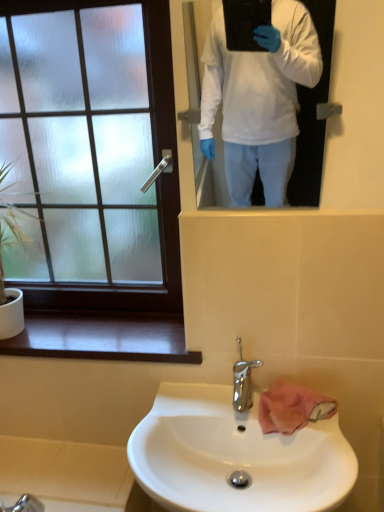
Question: Considering the relative positions of white glossy mirror at upper center and white glossy sink at lower center in the image provided, is white glossy mirror at upper center to the right of white glossy sink at lower center from the viewer's perspective?

Choices:
 (A) no
 (B) yes

Answer: (B)

Question: Is the depth of white glossy mirror at upper center less than that of white glossy sink at lower center?

Choices:
 (A) yes
 (B) no

Answer: (B)

Question: From a real-world perspective, is white glossy mirror at upper center on white glossy sink at lower center?

Choices:
 (A) yes
 (B) no

Answer: (A)

Question: Is white glossy mirror at upper center positioned far away from white glossy sink at lower center?

Choices:
 (A) no
 (B) yes

Answer: (B)

Question: Considering the relative sizes of white glossy mirror at upper center and white glossy sink at lower center in the image provided, is white glossy mirror at upper center thinner than white glossy sink at lower center?

Choices:
 (A) yes
 (B) no

Answer: (A)

Question: Can you confirm if white glossy mirror at upper center is bigger than white glossy sink at lower center?

Choices:
 (A) no
 (B) yes

Answer: (A)

Question: Is white glossy mirror at upper center closer to the viewer compared to frosted glass window at upper left?

Choices:
 (A) no
 (B) yes

Answer: (B)

Question: Can you confirm if white glossy mirror at upper center is wider than frosted glass window at upper left?

Choices:
 (A) no
 (B) yes

Answer: (A)

Question: Is white glossy mirror at upper center not close to frosted glass window at upper left?

Choices:
 (A) no
 (B) yes

Answer: (A)

Question: Is white glossy mirror at upper center taller than frosted glass window at upper left?

Choices:
 (A) yes
 (B) no

Answer: (B)

Question: Is white glossy mirror at upper center looking in the opposite direction of frosted glass window at upper left?

Choices:
 (A) yes
 (B) no

Answer: (B)

Question: Is white glossy mirror at upper center not inside frosted glass window at upper left?

Choices:
 (A) yes
 (B) no

Answer: (A)

Question: Does green leafy plant at left have a larger size compared to white glossy sink at lower center?

Choices:
 (A) no
 (B) yes

Answer: (A)